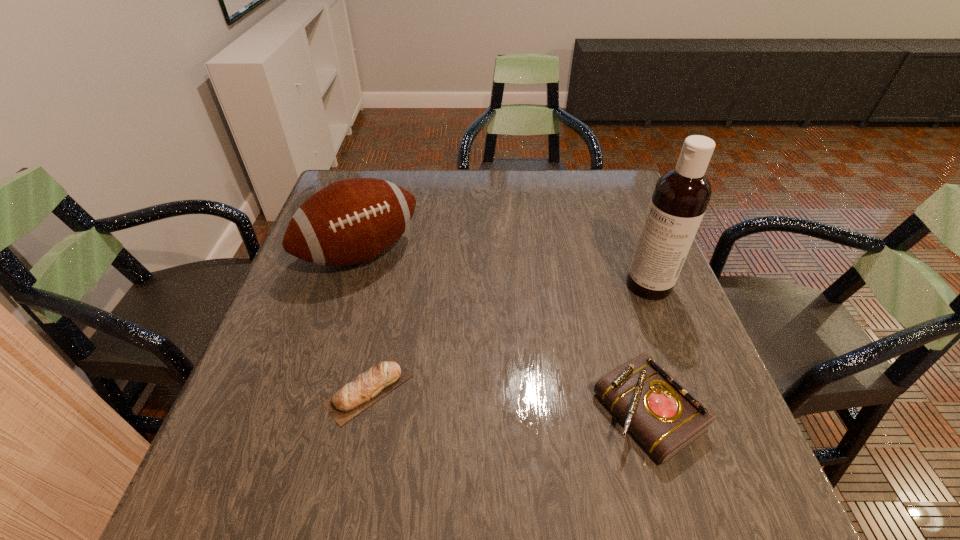
The width and height of the screenshot is (960, 540). What are the coordinates of `vacant space on the desktop that is between the shortest object and the third tallest object and is positioned on the laces of the football` in the screenshot? It's located at (474, 398).

At what (x,y) coordinates should I click in order to perform the action: click on vacant space on the desktop that is between the shortest object and the diary and is positioned on the label side of the tallest object. Please return your answer as a coordinate pair (x, y). Image resolution: width=960 pixels, height=540 pixels. Looking at the image, I should click on (484, 399).